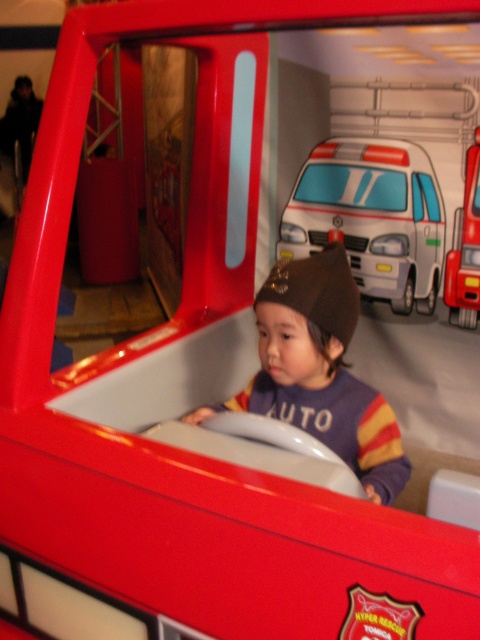
You are a parent looking at the image of your child in the red toy fire truck. You notice a point marked at coordinates (322,369). What object is located at that point?

A: The point at coordinates 0.571, 0.671 marks the purple soft hat at center.

You are a photographer standing 1 meter away from the purple soft hat at center. You want to take a photo of it with your camera. Can you reach the camera without moving your position?

The purple soft hat at center and camera are 1.19 meters apart. Since you are 1 meter away from the hat, the camera is 0.19 meters beyond your reach. You need to move closer to reach the camera.

You are a delivery robot in the image. You need to deliver a package to the white glossy ambulance at upper center located at point (372, 218). The robot has a 0.3 meter radius. Is there enough space to move around the ambulance?

The white glossy ambulance at upper center is located at point (372, 218). Since the robot has a 0.3 meter radius, it can navigate around the ambulance as long as there is sufficient clearance. However, the provided information does not specify the dimensions of the ambulance or the surrounding area, so we cannot confirm the exact space availability. Please check the environment for obstacles or narrow pathways.